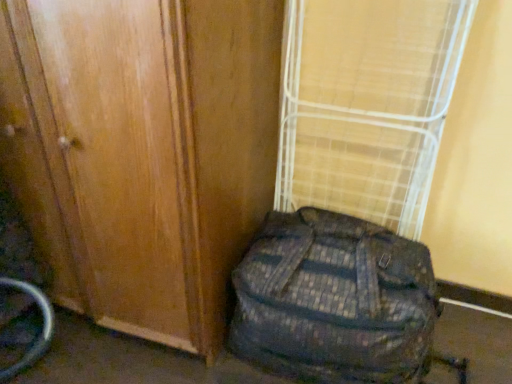
Question: Considering the relative positions of bamboo mat at center and wooden door at center in the image provided, is bamboo mat at center to the right of wooden door at center from the viewer's perspective?

Choices:
 (A) yes
 (B) no

Answer: (A)

Question: Is bamboo mat at center bigger than wooden door at center?

Choices:
 (A) yes
 (B) no

Answer: (B)

Question: From a real-world perspective, is bamboo mat at center positioned over wooden door at center based on gravity?

Choices:
 (A) yes
 (B) no

Answer: (A)

Question: From the image's perspective, is bamboo mat at center located beneath wooden door at center?

Choices:
 (A) yes
 (B) no

Answer: (B)

Question: From a real-world perspective, does bamboo mat at center sit lower than wooden door at center?

Choices:
 (A) yes
 (B) no

Answer: (B)

Question: From a real-world perspective, is wooden door at center above or below camouflage fabric backpack at lower right?

Choices:
 (A) above
 (B) below

Answer: (A)

Question: From their relative heights in the image, would you say wooden door at center is taller or shorter than camouflage fabric backpack at lower right?

Choices:
 (A) tall
 (B) short

Answer: (A)

Question: Would you say wooden door at center is to the left or to the right of camouflage fabric backpack at lower right in the picture?

Choices:
 (A) left
 (B) right

Answer: (A)

Question: Would you say wooden door at center is inside or outside camouflage fabric backpack at lower right?

Choices:
 (A) outside
 (B) inside

Answer: (A)

Question: In terms of height, does wooden door at center look taller or shorter compared to bamboo mat at center?

Choices:
 (A) tall
 (B) short

Answer: (A)

Question: From a real-world perspective, is wooden door at center above or below bamboo mat at center?

Choices:
 (A) below
 (B) above

Answer: (A)

Question: From the image's perspective, is wooden door at center positioned above or below bamboo mat at center?

Choices:
 (A) below
 (B) above

Answer: (A)

Question: Looking at their shapes, would you say wooden door at center is wider or thinner than bamboo mat at center?

Choices:
 (A) thin
 (B) wide

Answer: (B)

Question: Relative to wooden door at center, is camouflage fabric backpack at lower right in front or behind?

Choices:
 (A) behind
 (B) front

Answer: (A)

Question: In terms of height, does camouflage fabric backpack at lower right look taller or shorter compared to wooden door at center?

Choices:
 (A) short
 (B) tall

Answer: (A)